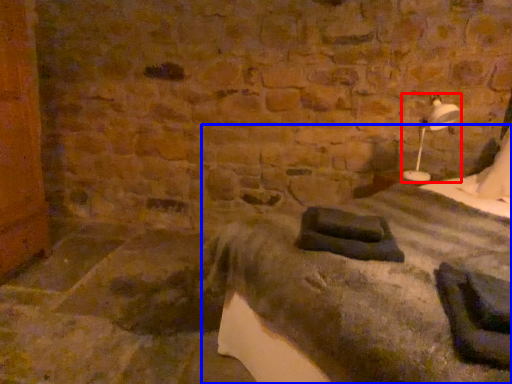
Question: Which object appears farthest to the camera in this image, bedside lamp (highlighted by a red box) or bed (highlighted by a blue box)?

Choices:
 (A) bedside lamp
 (B) bed

Answer: (A)